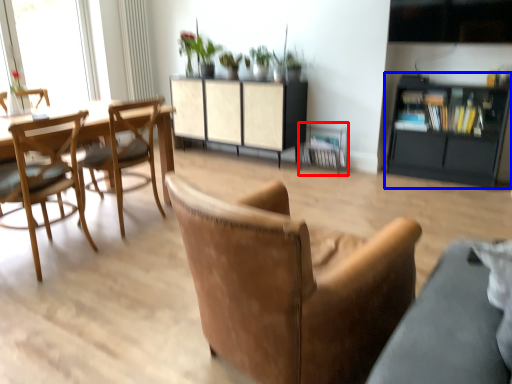
Question: Which point is closer to the camera, armchair (highlighted by a red box) or cabinetry (highlighted by a blue box)?

Choices:
 (A) armchair
 (B) cabinetry

Answer: (B)